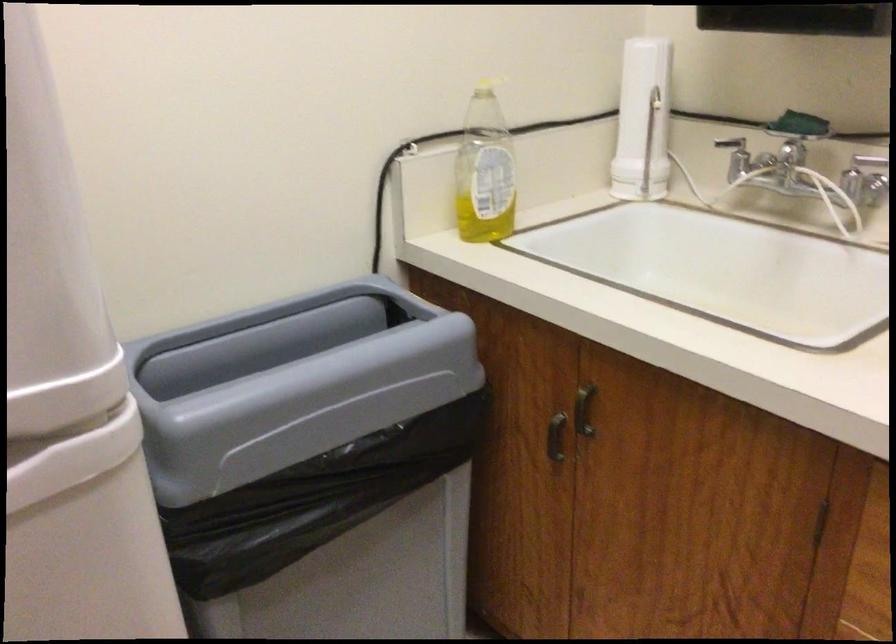
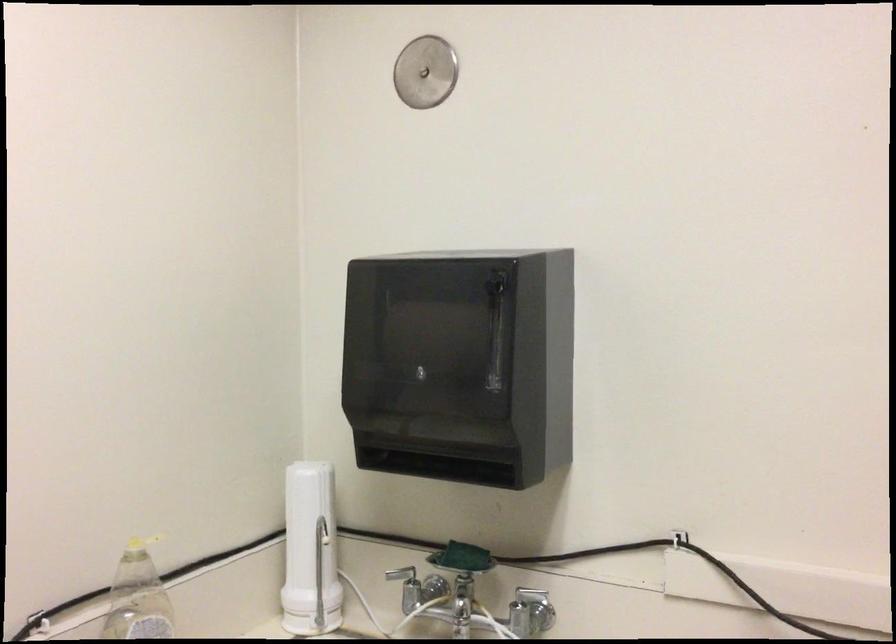
The point at (819, 200) is marked in the first image. Where is the corresponding point in the second image?

(490, 621)